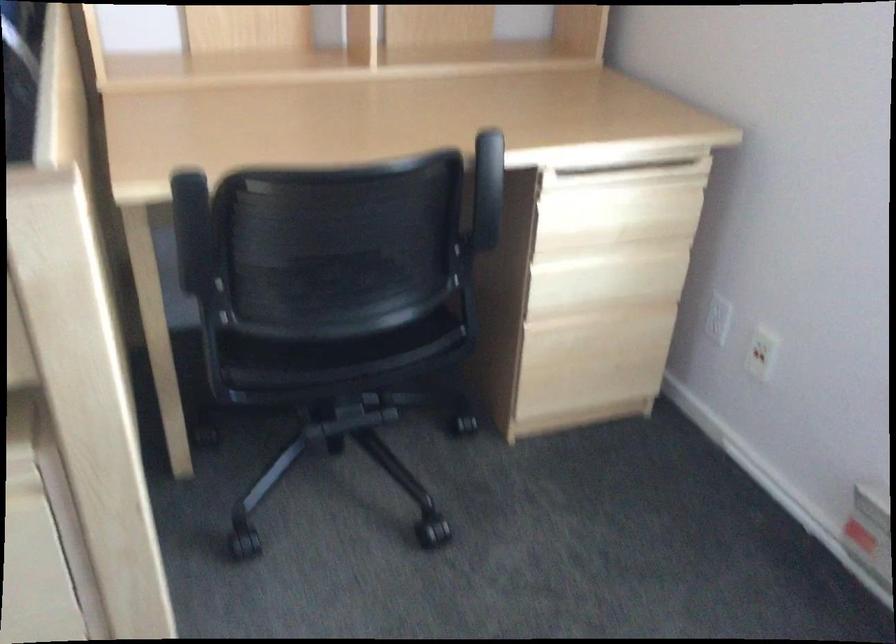
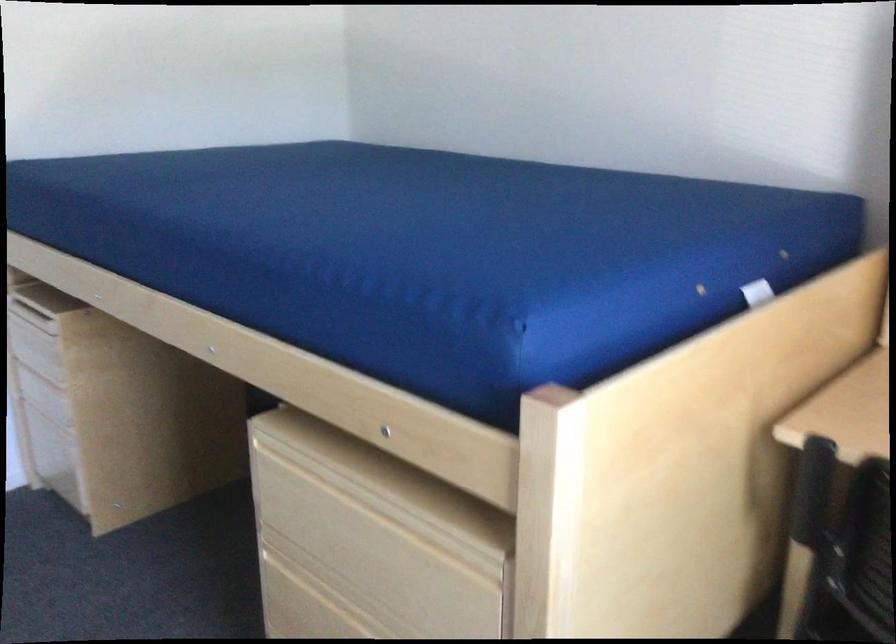
Question: The camera is either moving clockwise (left) or counter-clockwise (right) around the object. The first image is from the beginning of the video and the second image is from the end. Is the camera moving left or right when shooting the video?

Choices:
 (A) Left
 (B) Right

Answer: (B)